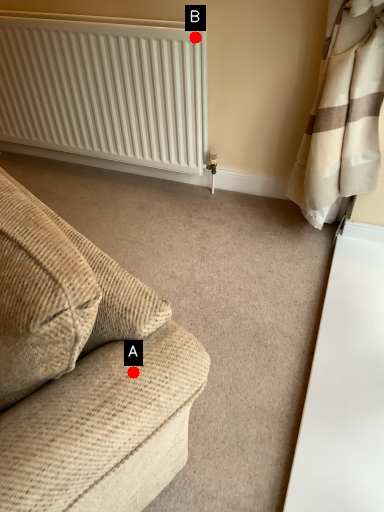
Question: Two points are circled on the image, labeled by A and B beside each circle. Which of the following is the closest to the observer?

Choices:
 (A) A is closer
 (B) B is closer

Answer: (A)